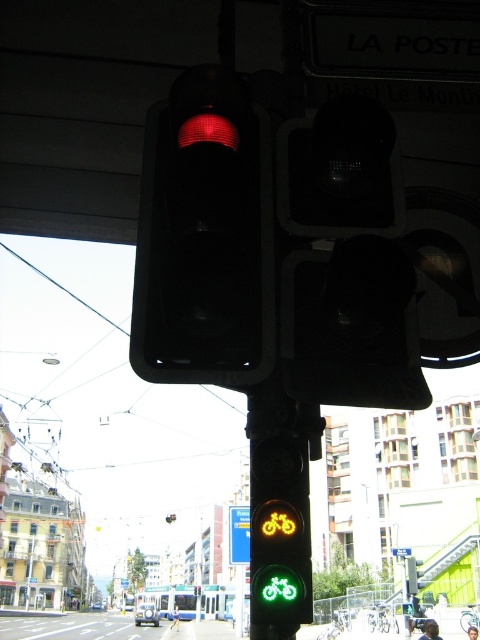
Is matte red traffic light at upper center taller than blue plastic road sign at upper center?

In fact, matte red traffic light at upper center may be shorter than blue plastic road sign at upper center.

What do you see at coordinates (207, 131) in the screenshot?
I see `matte red traffic light at upper center` at bounding box center [207, 131].

The width and height of the screenshot is (480, 640). Describe the element at coordinates (207, 131) in the screenshot. I see `matte red traffic light at upper center` at that location.

At what (x,y) coordinates should I click in order to perform the action: click on matte red traffic light at upper center. Please return your answer as a coordinate pair (x, y). This screenshot has width=480, height=640. Looking at the image, I should click on (207, 131).

Does matte black traffic light at upper center appear on the left side of blue plastic road sign at upper center?

In fact, matte black traffic light at upper center is to the right of blue plastic road sign at upper center.

Based on the photo, which is below, matte black traffic light at upper center or blue plastic road sign at upper center?

blue plastic road sign at upper center is lower down.

Locate an element on the screen. matte black traffic light at upper center is located at coordinates (204, 237).

From the picture: Is blue plastic bicycle at lower center bigger than blue plastic road sign at upper center?

No, blue plastic bicycle at lower center is not bigger than blue plastic road sign at upper center.

Where is `blue plastic bicycle at lower center`? blue plastic bicycle at lower center is located at coordinates (239, 534).

In order to click on blue plastic bicycle at lower center in this screenshot , I will do `click(239, 534)`.